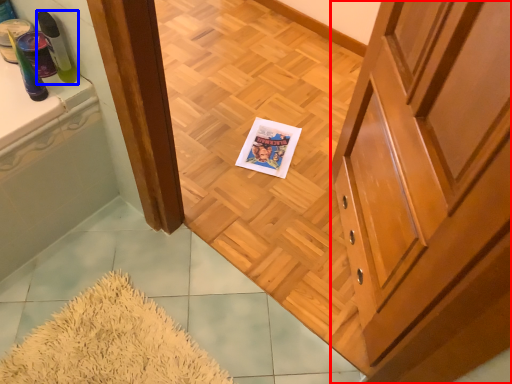
Question: Which object appears closest to the camera in this image, cabinetry (highlighted by a red box) or toiletry (highlighted by a blue box)?

Choices:
 (A) cabinetry
 (B) toiletry

Answer: (A)